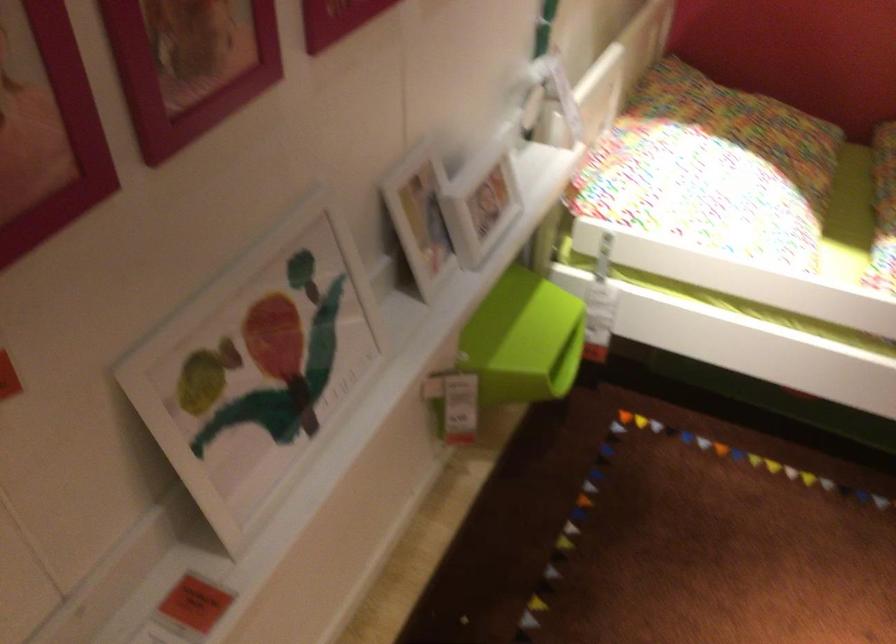
I want to click on large white picture frame, so click(x=257, y=368).